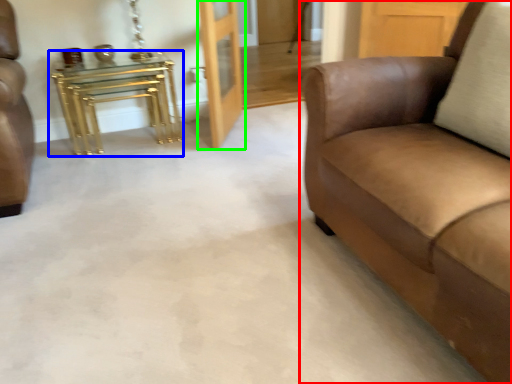
Question: Which object is the farthest from studio couch (highlighted by a red box)? Choose among these: table (highlighted by a blue box) or door (highlighted by a green box).

Choices:
 (A) table
 (B) door

Answer: (A)